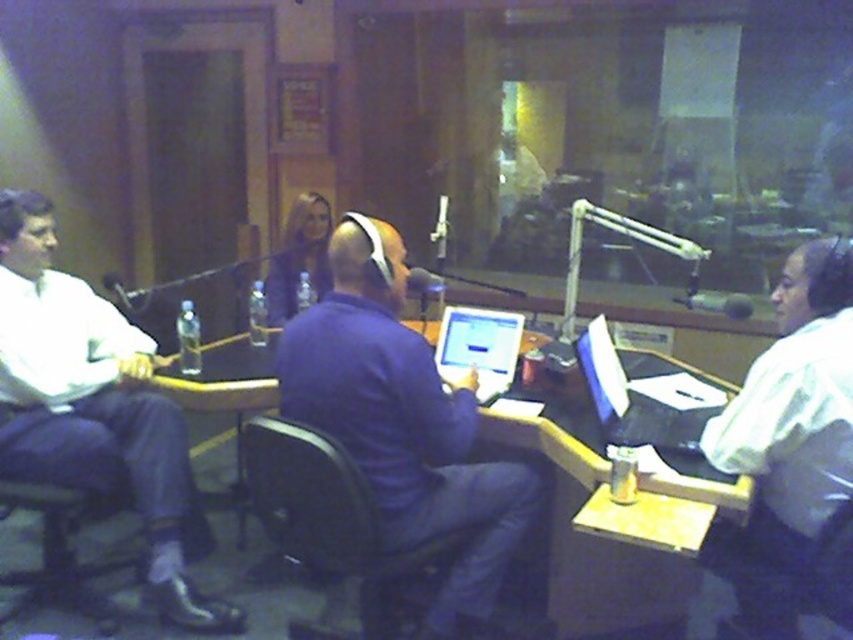
Can you confirm if purple matte shirt at center is positioned below matte black microphone at center?

Yes.

Measure the distance from purple matte shirt at center to matte black microphone at center.

purple matte shirt at center is 47.79 centimeters from matte black microphone at center.

Describe the element at coordinates (404, 422) in the screenshot. I see `purple matte shirt at center` at that location.

The height and width of the screenshot is (640, 853). I want to click on purple matte shirt at center, so click(x=404, y=422).

Which is above, purple matte shirt at center or wooden table at center?

purple matte shirt at center is above.

This screenshot has width=853, height=640. What do you see at coordinates (404, 422) in the screenshot?
I see `purple matte shirt at center` at bounding box center [404, 422].

Locate an element on the screen. The width and height of the screenshot is (853, 640). purple matte shirt at center is located at coordinates (404, 422).

Can you confirm if purple matte shirt at center is smaller than smooth purple shirt at center?

No.

I want to click on purple matte shirt at center, so click(404, 422).

Find the location of `purple matte shirt at center`. purple matte shirt at center is located at coordinates (404, 422).